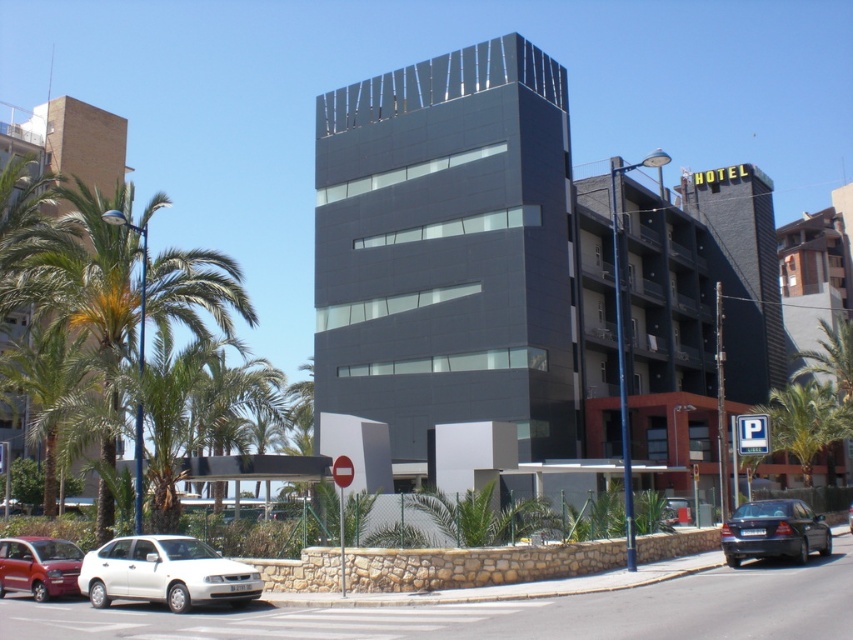
Does white matte sedan at lower left appear on the left side of silver metallic sedan at center?

Yes, white matte sedan at lower left is to the left of silver metallic sedan at center.

Which is in front, point (160, 589) or point (850, 508)?

Positioned in front is point (160, 589).

This screenshot has height=640, width=853. Identify the location of white matte sedan at lower left. (165, 572).

Is white matte sedan at lower left behind green leafy palm tree at lower right?

No, it is in front of green leafy palm tree at lower right.

Who is more distant from viewer, (173, 548) or (809, 433)?

The point (809, 433) is behind.

Locate an element on the screen. white matte sedan at lower left is located at coordinates (165, 572).

Which is more to the right, matte glass building at center or green leafy palm tree at lower right?

green leafy palm tree at lower right is more to the right.

Is matte glass building at center above green leafy palm tree at lower right?

Yes.

Where is `matte glass building at center`? This screenshot has width=853, height=640. matte glass building at center is located at coordinates (459, 253).